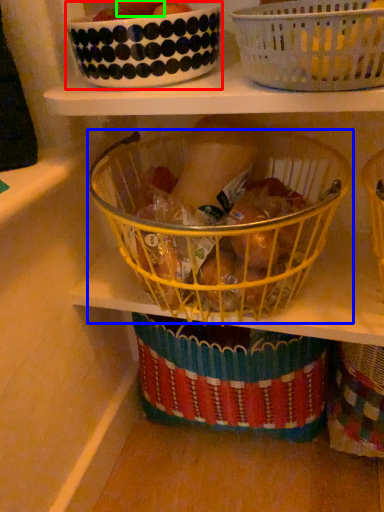
Question: Which is nearer to the glass bowl (highlighted by a red box)? basket (highlighted by a blue box) or fruit (highlighted by a green box).

Choices:
 (A) basket
 (B) fruit

Answer: (B)